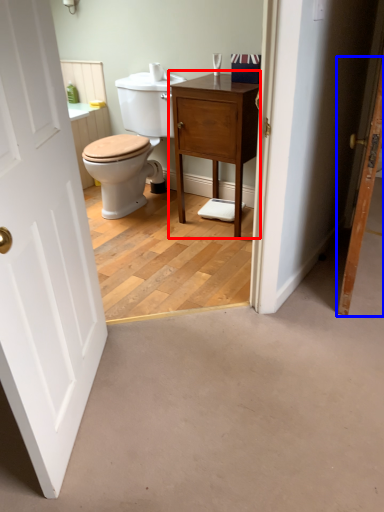
Question: Which point is further to the camera, nightstand (highlighted by a red box) or door (highlighted by a blue box)?

Choices:
 (A) nightstand
 (B) door

Answer: (A)